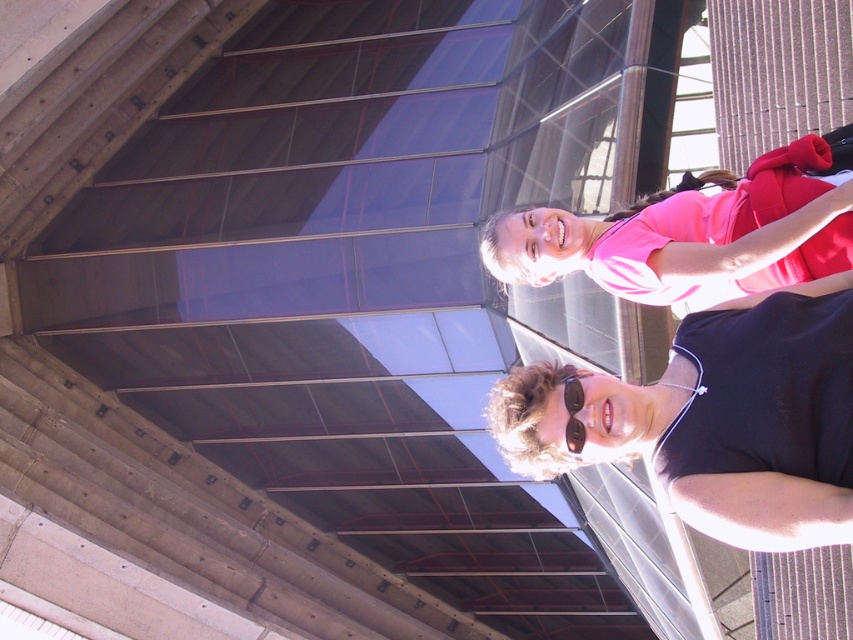
You are a photographer trying to capture a clear shot of both the black matte sunglasses at lower right and the pink fabric shirt at upper right. Since the building has reflective glass panels, you need to adjust your camera angle to avoid glare. Which object should you prioritize positioning first to minimize glare interference?

The black matte sunglasses at lower right should be prioritized first because it is thinner than the pink fabric shirt at upper right, making it harder to frame without glare affecting its visibility.

You are a photographer trying to capture the reflection of the black matte sunglasses at lower right in the glass panels of the building. Based on the scene description, where should you position yourself to ensure the sunglasses are reflected in the glass panels?

To capture the reflection of the black matte sunglasses at lower right in the glass panels, position yourself directly in front of the sunglasses at point (721, 420) so that the glass panels can reflect the sunglasses into the camera lens.